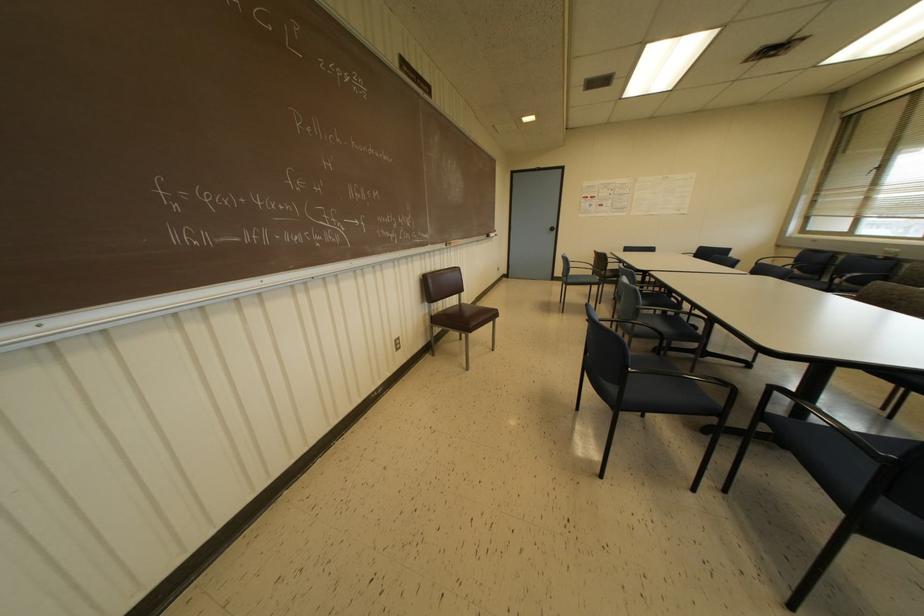
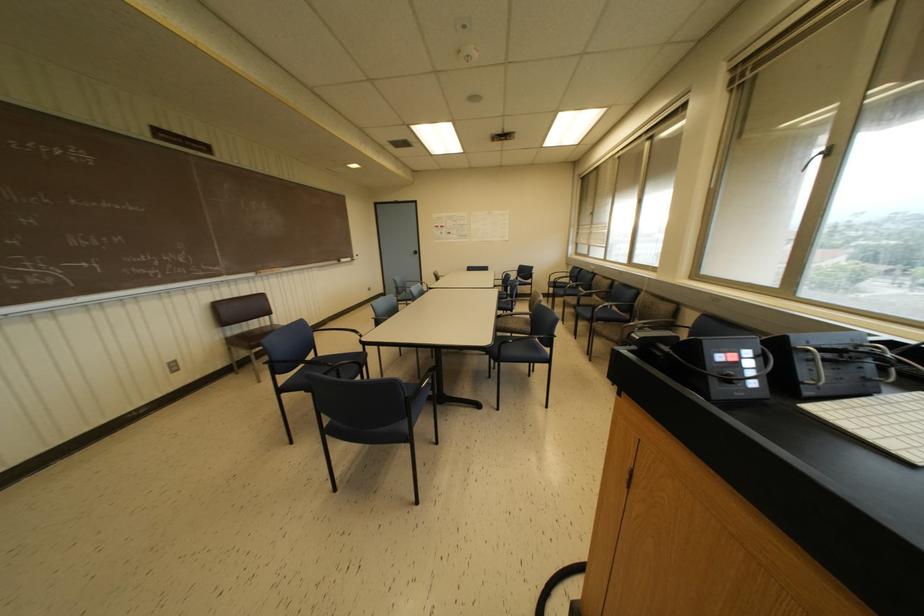
Locate, in the second image, the point that corresponds to (x=491, y=233) in the first image.

(342, 259)